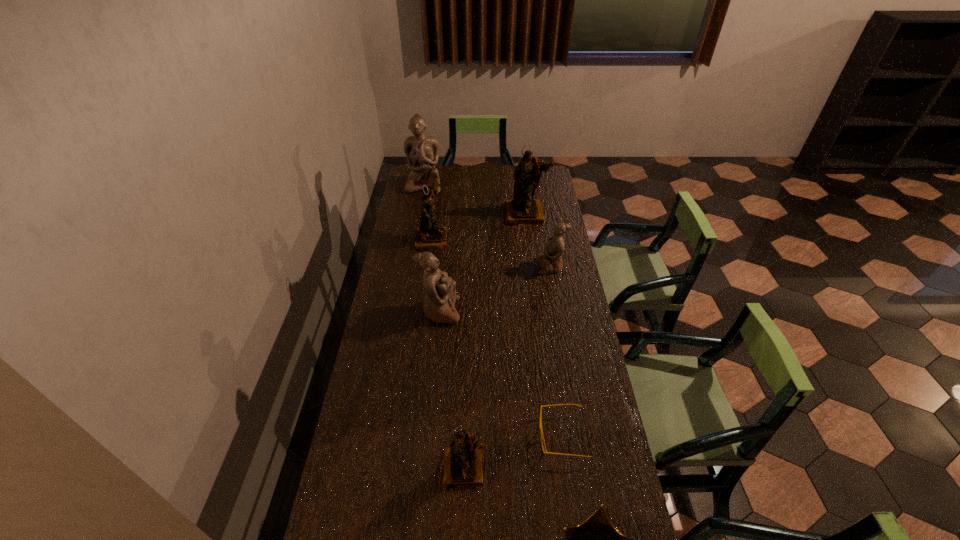
Find the location of a particular element. This screenshot has width=960, height=540. free space located 0.270m on the front-facing side of the smallest white figurine is located at coordinates (476, 266).

Locate an element on the screen. The width and height of the screenshot is (960, 540). free location located on the front-facing side of the nearest gold figurine is located at coordinates (465, 519).

Locate an element on the screen. vacant space located in front of the lenses of the shortest object is located at coordinates (511, 436).

The height and width of the screenshot is (540, 960). Find the location of `vacant space located in front of the lenses of the shortest object`. vacant space located in front of the lenses of the shortest object is located at coordinates (511, 436).

This screenshot has height=540, width=960. What are the coordinates of `vacant space located 0.250m in front of the lenses of the shortest object` in the screenshot? It's located at (459, 436).

The height and width of the screenshot is (540, 960). In order to click on object at the far edge in this screenshot , I will do `click(422, 152)`.

The width and height of the screenshot is (960, 540). In order to click on spectacles present at the right edge in this screenshot , I will do `click(542, 436)`.

Find the location of a particular element. object that is at the far left corner is located at coordinates (422, 152).

In the image, there is a desktop. Where is `vacant space at the far edge`? This screenshot has width=960, height=540. vacant space at the far edge is located at coordinates (502, 184).

Where is `vacant space at the left edge of the desktop`? vacant space at the left edge of the desktop is located at coordinates (416, 318).